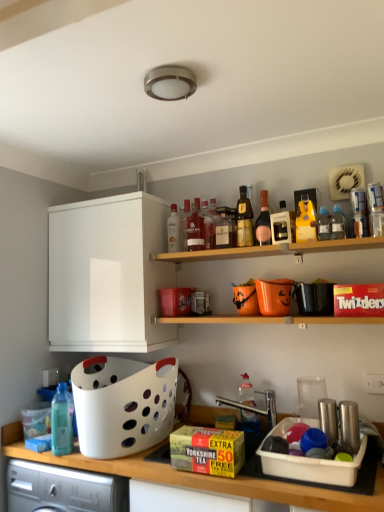
I want to click on translucent glass bottle at center, the sixth bottle from the left, so click(x=223, y=229).

Where is `translucent plastic bottle at center, placed as the 5th bottle when sorted from right to left`? This screenshot has height=512, width=384. translucent plastic bottle at center, placed as the 5th bottle when sorted from right to left is located at coordinates (246, 391).

The width and height of the screenshot is (384, 512). I want to click on shiny metallic cups at right, which appears as the 1th appliance when ordered from the bottom, so click(349, 423).

Find the location of a particular element. yellow matte bottle at upper center, the 10th bottle positioned from the left is located at coordinates (305, 220).

From a real-world perspective, which object rests below the other?

From a 3D spatial view, shiny metallic cups at right, the 2th appliance in the back-to-front sequence, is below.

Is point (325, 287) positioned behind point (344, 421)?

That is True.

Is black plastic bag at upper right, which appears as the 1th appliance when viewed from the back, placed right next to shiny metallic cups at right, which appears as the 1th appliance when ordered from the bottom?

No, black plastic bag at upper right, which appears as the 1th appliance when viewed from the back, is not making contact with shiny metallic cups at right, which appears as the 1th appliance when ordered from the bottom.

Find the location of a particular element. The width and height of the screenshot is (384, 512). appliance above the shiny metallic cups at right, which ranks as the second appliance in top-to-bottom order (from a real-world perspective) is located at coordinates (314, 298).

Which object is positioned more to the right, white plastic basket at lower left or pink glass bottle at upper center, the 9th bottle viewed from the left?

pink glass bottle at upper center, the 9th bottle viewed from the left, is more to the right.

From the image's perspective, is white plastic basket at lower left on top of pink glass bottle at upper center, the 9th bottle viewed from the left?

No, from the image's perspective, white plastic basket at lower left is not on top of pink glass bottle at upper center, the 9th bottle viewed from the left.

From a real-world perspective, between white plastic basket at lower left and pink glass bottle at upper center, the 9th bottle viewed from the left, who is vertically higher?

pink glass bottle at upper center, the 9th bottle viewed from the left, from a real-world perspective.

Can you tell me how much clear plastic bottle at upper right, the 2th bottle positioned from the right, and translucent glass bottle at center, which is counted as the fifth bottle, starting from the left, differ in facing direction?

0.402 degrees.

Looking at the image, does clear plastic bottle at upper right, the 2th bottle positioned from the right, seem bigger or smaller compared to translucent glass bottle at center, which is counted as the fifth bottle, starting from the left?

In the image, clear plastic bottle at upper right, the 2th bottle positioned from the right, appears to be smaller than translucent glass bottle at center, which is counted as the fifth bottle, starting from the left.

Which point is more distant from viewer, (320, 211) or (202, 227)?

The point (202, 227) is more distant.

This screenshot has width=384, height=512. Find the location of `the 3rd bottle above the clear plastic bottle at upper right, the 2th bottle positioned from the right (from the image's perspective)`. the 3rd bottle above the clear plastic bottle at upper right, the 2th bottle positioned from the right (from the image's perspective) is located at coordinates (206, 225).

Can you see black plastic bag at upper right, the 2th appliance positioned from the front, touching translucent glass bottle at center, which is counted as the fifth bottle, starting from the left?

No.

In terms of height, does black plastic bag at upper right, the second appliance ordered from the bottom, look taller or shorter compared to translucent glass bottle at center, which is counted as the fifth bottle, starting from the left?

black plastic bag at upper right, the second appliance ordered from the bottom, is shorter than translucent glass bottle at center, which is counted as the fifth bottle, starting from the left.

How different are the orientations of black plastic bag at upper right, the second appliance ordered from the bottom, and translucent glass bottle at center, which is counted as the fifth bottle, starting from the left, in degrees?

0.402 degrees separate the facing orientations of black plastic bag at upper right, the second appliance ordered from the bottom, and translucent glass bottle at center, which is counted as the fifth bottle, starting from the left.

Does white matte cabinet at upper left have a lesser width compared to wooden shelf at upper center?

In fact, white matte cabinet at upper left might be wider than wooden shelf at upper center.

Is wooden shelf at upper center completely or partially inside white matte cabinet at upper left?

No, wooden shelf at upper center is not inside white matte cabinet at upper left.

Considering the sizes of white matte cabinet at upper left and wooden shelf at upper center in the image, is white matte cabinet at upper left taller or shorter than wooden shelf at upper center?

In the image, white matte cabinet at upper left appears to be taller than wooden shelf at upper center.

Is wooden shelf at upper center at the back of white matte cabinet at upper left?

white matte cabinet at upper left does not have its back to wooden shelf at upper center.

Considering the relative sizes of translucent glass bottle at center, which is counted as the fifth bottle, starting from the left, and transparent plastic bottle at lower left, which appears as the 1th bottle when viewed from the left, in the image provided, is translucent glass bottle at center, which is counted as the fifth bottle, starting from the left, wider than transparent plastic bottle at lower left, which appears as the 1th bottle when viewed from the left,?

In fact, translucent glass bottle at center, which is counted as the fifth bottle, starting from the left, might be narrower than transparent plastic bottle at lower left, which appears as the 1th bottle when viewed from the left.

How many degrees apart are the facing directions of translucent glass bottle at center, the 8th bottle viewed from the right, and transparent plastic bottle at lower left, which appears as the 1th bottle when viewed from the left?

There is a 4.05-degree angle between the facing directions of translucent glass bottle at center, the 8th bottle viewed from the right, and transparent plastic bottle at lower left, which appears as the 1th bottle when viewed from the left.

Between translucent glass bottle at center, the 8th bottle viewed from the right, and transparent plastic bottle at lower left, the 12th bottle viewed from the right, which one has less height?

Standing shorter between the two is transparent plastic bottle at lower left, the 12th bottle viewed from the right.

Is translucent glass bottle at center, the 8th bottle viewed from the right, behind transparent plastic bottle at lower left, which appears as the 1th bottle when viewed from the left?

That is True.

Does white matte cabinet at upper left have a greater width compared to translucent glass bottle at center, which is the 7th bottle in right-to-left order?

Yes.

Considering the positions of objects white matte cabinet at upper left and translucent glass bottle at center, the sixth bottle from the left, in the image provided, who is more to the left, white matte cabinet at upper left or translucent glass bottle at center, the sixth bottle from the left,?

From the viewer's perspective, white matte cabinet at upper left appears more on the left side.

Is white matte cabinet at upper left far away from translucent glass bottle at center, the sixth bottle from the left?

That's not correct — white matte cabinet at upper left is a little close to translucent glass bottle at center, the sixth bottle from the left.

Choose the correct answer: Is white matte cabinet at upper left inside translucent glass bottle at center, which is the 7th bottle in right-to-left order, or outside it?

The correct answer is: outside.

Locate an element on the screen. appliance lying above the shiny metallic cups at right, which ranks as the second appliance in top-to-bottom order (from the image's perspective) is located at coordinates (314, 298).

Locate an element on the screen. The height and width of the screenshot is (512, 384). basket on the left of pink glass bottle at upper center, the 4th bottle from the right is located at coordinates (123, 404).

Estimate the real-world distances between objects in this image. Which object is further from clear glass bottle at center, marked as the 11th bottle in a right-to-left arrangement, pink glass bottle at upper center, the 9th bottle viewed from the left, or translucent glass bottle at center, the sixth bottle from the left?

The object further to clear glass bottle at center, marked as the 11th bottle in a right-to-left arrangement, is pink glass bottle at upper center, the 9th bottle viewed from the left.

Looking at the image, which one is located closer to transparent plastic bottle at lower left, the 12th bottle viewed from the right, pink glass bottle at upper center, the 4th bottle from the right, or clear plastic bottle at upper right, the 2th bottle positioned from the right?

Based on the image, pink glass bottle at upper center, the 4th bottle from the right, appears to be nearer to transparent plastic bottle at lower left, the 12th bottle viewed from the right.

In the scene shown: Looking at the image, which one is located further to clear glass bottle at center, marked as the 11th bottle in a right-to-left arrangement, shiny gold bottle at center, positioned as the 7th bottle in left-to-right order, or white plastic basket at lower left?

Based on the image, white plastic basket at lower left appears to be further to clear glass bottle at center, marked as the 11th bottle in a right-to-left arrangement.

Based on their spatial positions, is shiny metallic cups at right, the 2th appliance in the back-to-front sequence, or shiny gold bottle at center, acting as the 6th bottle starting from the right, closer to translucent glass bottle at center, which is the 7th bottle in right-to-left order?

shiny gold bottle at center, acting as the 6th bottle starting from the right, lies closer to translucent glass bottle at center, which is the 7th bottle in right-to-left order, than the other object.

When comparing their distances from wooden shelf at upper center, does matte glass bottle at center, the ninth bottle positioned from the right, or translucent plastic bottle at upper right, acting as the first bottle starting from the right, seem closer?

Based on the image, matte glass bottle at center, the ninth bottle positioned from the right, appears to be nearer to wooden shelf at upper center.

Looking at this image, which object lies further to the anchor point translucent plastic bottle at center, the eighth bottle positioned from the left, wooden shelf at upper center or translucent glass bottle at center, which is counted as the fifth bottle, starting from the left?

Among the two, translucent glass bottle at center, which is counted as the fifth bottle, starting from the left, is located further to translucent plastic bottle at center, the eighth bottle positioned from the left.

Based on their spatial positions, is black plastic bag at upper right, the second appliance ordered from the bottom, or matte glass bottle at upper center, the 3th bottle when ordered from left to right, closer to translucent glass bottle at center, which is counted as the fifth bottle, starting from the left?

Based on the image, matte glass bottle at upper center, the 3th bottle when ordered from left to right, appears to be nearer to translucent glass bottle at center, which is counted as the fifth bottle, starting from the left.

Considering their positions, is translucent glass bottle at center, the 8th bottle viewed from the right, positioned further to yellow matte bottle at upper center, the 10th bottle positioned from the left, than clear glass bottle at center, marked as the 11th bottle in a right-to-left arrangement?

clear glass bottle at center, marked as the 11th bottle in a right-to-left arrangement.

The width and height of the screenshot is (384, 512). Identify the location of appliance between white matte cabinet at upper left and clear plastic bottle at upper right, which is the 11th bottle from left to right, in the horizontal direction. (314, 298).

The image size is (384, 512). I want to click on cabinetry between translucent glass bottle at center, which is the 7th bottle in right-to-left order, and translucent plastic bottle at center, the eighth bottle positioned from the left, in the vertical direction, so click(x=107, y=274).

Identify the location of shelf between shiny gold bottle at center, positioned as the 7th bottle in left-to-right order, and translucent plastic bottle at center, the eighth bottle positioned from the left, from top to bottom. (271, 250).

Where is `bottle between matte glass bottle at center, which appears as the fourth bottle when viewed from the left, and translucent glass bottle at center, which is the 7th bottle in right-to-left order`? The height and width of the screenshot is (512, 384). bottle between matte glass bottle at center, which appears as the fourth bottle when viewed from the left, and translucent glass bottle at center, which is the 7th bottle in right-to-left order is located at coordinates (206, 225).